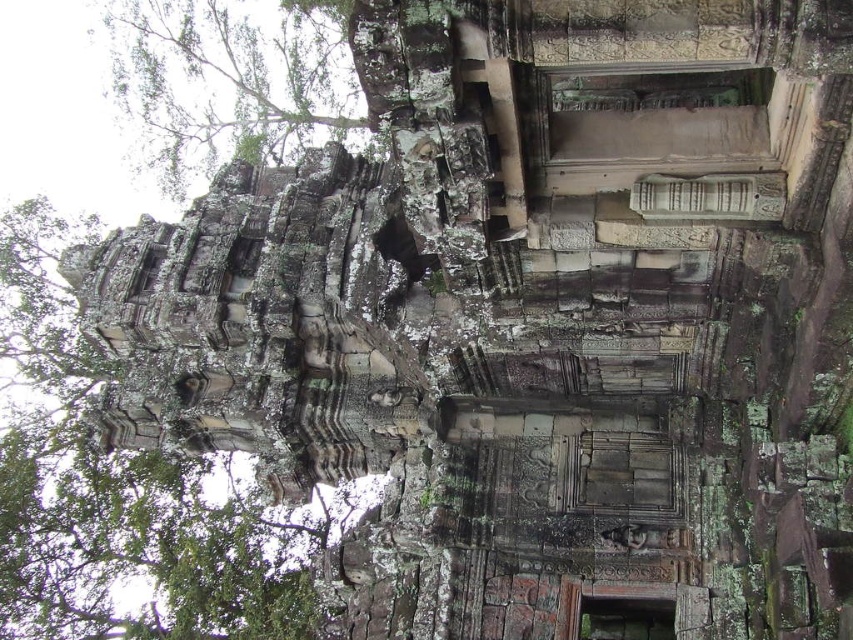
Question: Does green mossy stone tower at left have a larger size compared to green leafy tree at upper left?

Choices:
 (A) no
 (B) yes

Answer: (B)

Question: Considering the relative positions of green mossy stone tower at left and green leafy tree at upper left in the image provided, where is green mossy stone tower at left located with respect to green leafy tree at upper left?

Choices:
 (A) below
 (B) above

Answer: (A)

Question: Can you confirm if green mossy stone tower at left is bigger than green leafy tree at upper left?

Choices:
 (A) no
 (B) yes

Answer: (B)

Question: Among these points, which one is nearest to the camera?

Choices:
 (A) (338, 86)
 (B) (204, 614)

Answer: (B)

Question: Which point is farther from the camera taking this photo?

Choices:
 (A) (234, 100)
 (B) (126, 525)

Answer: (A)